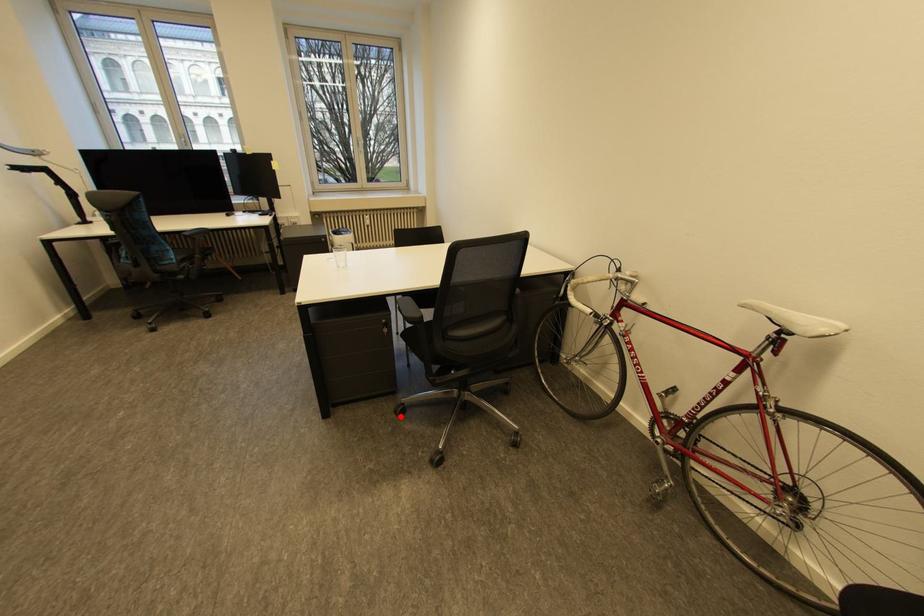
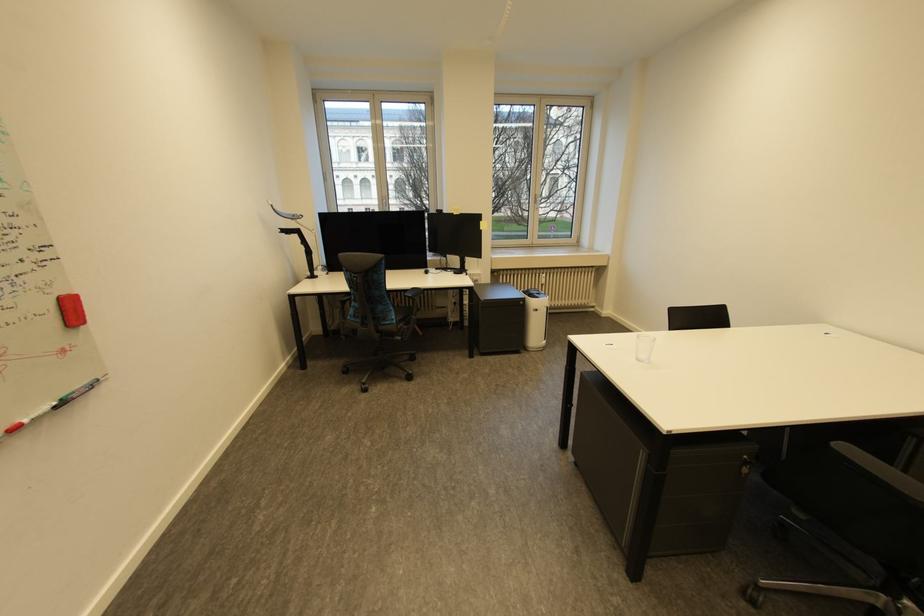
Question: I am providing you with two images of the same scene from different viewpoints. In image1, a red point is highlighted. Considering the same 3D point in image2, which of the following is correct?

Choices:
 (A) It is closer
 (B) It is farther

Answer: (A)